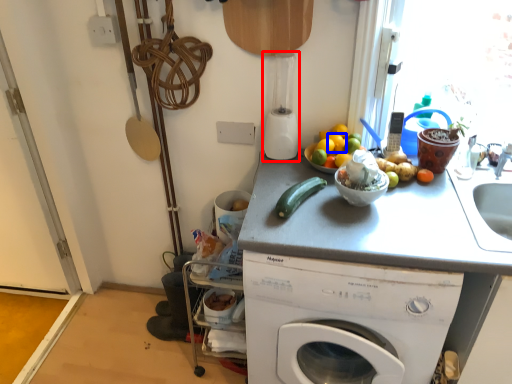
Question: Which of the following is the farthest to the observer, blender (highlighted by a red box) or orange (highlighted by a blue box)?

Choices:
 (A) blender
 (B) orange

Answer: (B)